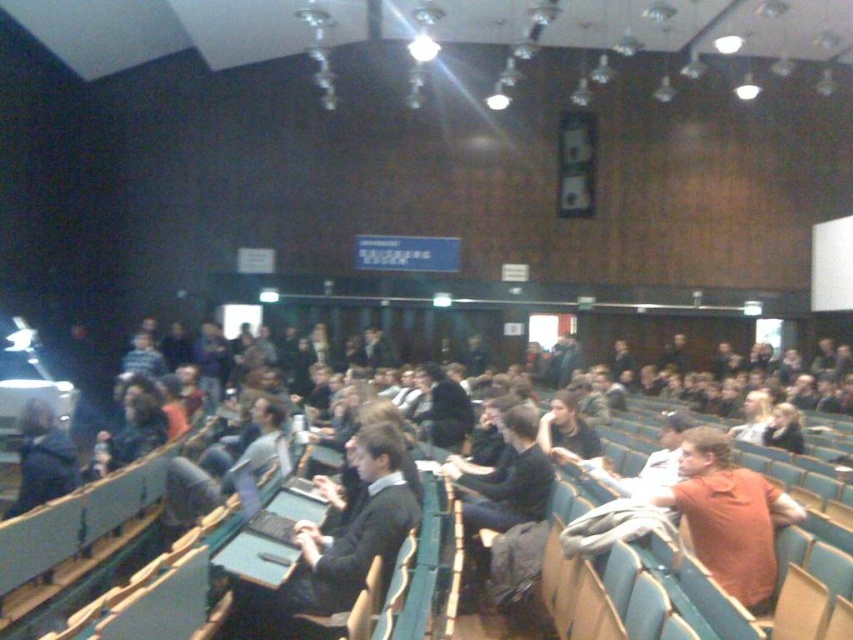
You are organizing a photo shoot in this lecture hall and need to ensure that both the orange matte shirt at center and the dark blue jacket at center are visible in the frame. Given their sizes, which one should you focus on to ensure both are captured adequately?

The orange matte shirt at center is larger than the dark blue jacket at center, so focusing on the orange matte shirt at center would help ensure both are adequately captured in the frame.

You are sitting in the front row of the lecture hall and notice two people in the middle of the crowd. One is wearing a dark gray sweater at center, and the other is wearing an orange matte shirt at center. If you want to wave to the person on the right, which clothing item should you wave towards?

You should wave towards the orange matte shirt at center because the dark gray sweater at center is to the left of it, making the orange matte shirt at center the one on the right.